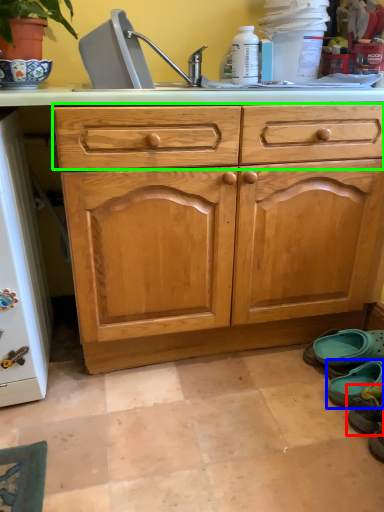
Question: Which object is the closest to the footwear (highlighted by a red box)? Choose among these: footwear (highlighted by a blue box) or drawer (highlighted by a green box).

Choices:
 (A) footwear
 (B) drawer

Answer: (A)